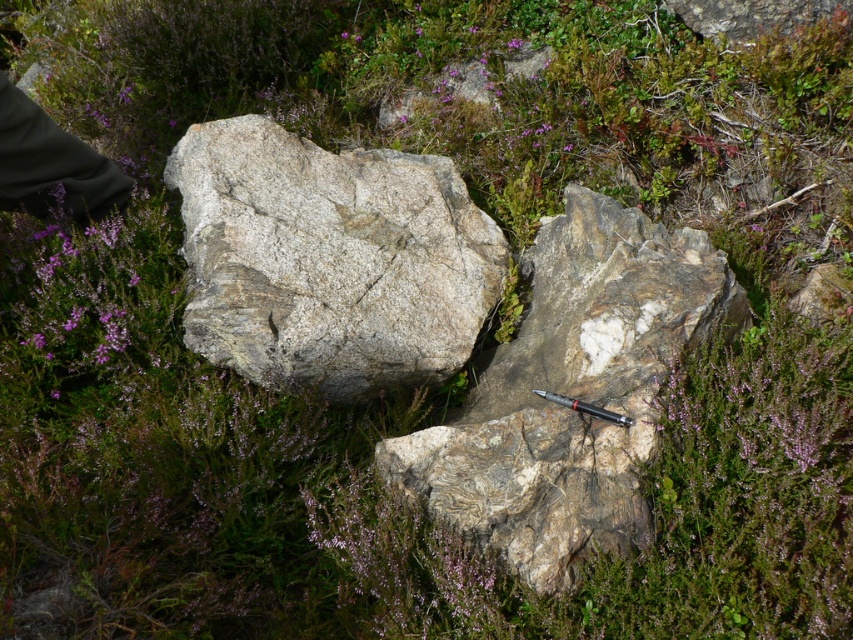
You are standing at the point marked as point (329,259) in the image. What object are you directly facing?

You are directly facing the gray granite boulder at center as indicated by point (329,259).